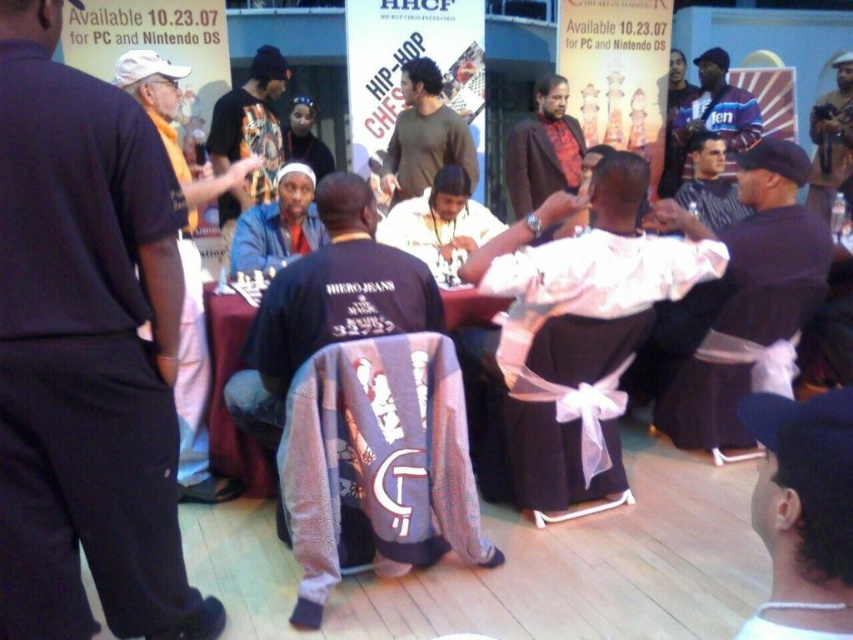
Question: Which point is farther to the camera?

Choices:
 (A) dark brown leather jacket at upper right
 (B) dark gray fabric chair at center

Answer: (A)

Question: Can you confirm if brown textured suit at center is bigger than white satin robe at center?

Choices:
 (A) no
 (B) yes

Answer: (B)

Question: Which point is closer to the camera taking this photo?

Choices:
 (A) (231, 268)
 (B) (416, 172)

Answer: (A)

Question: Can you confirm if brown textured suit at center is positioned above matte blue shirt at center?

Choices:
 (A) no
 (B) yes

Answer: (B)

Question: Which point is closer to the camera taking this photo?

Choices:
 (A) (840, 68)
 (B) (321, 150)
 (C) (190, 477)

Answer: (C)

Question: Does brown textured shirt at center have a greater width compared to matte black shirt at center?

Choices:
 (A) yes
 (B) no

Answer: (A)